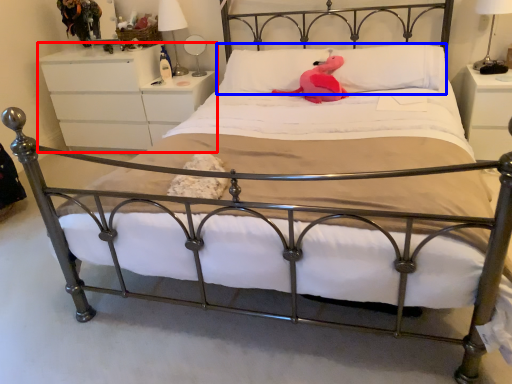
Question: Among these objects, which one is farthest to the camera, nightstand (highlighted by a red box) or pillow (highlighted by a blue box)?

Choices:
 (A) nightstand
 (B) pillow

Answer: (A)